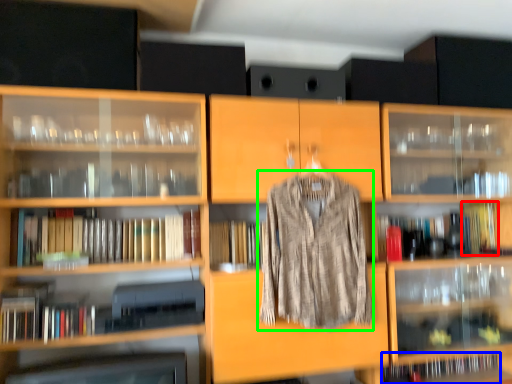
Question: Estimate the real-world distances between objects in this image. Which object is farther from book (highlighted by a red box), book (highlighted by a blue box) or clothing (highlighted by a green box)?

Choices:
 (A) book
 (B) clothing

Answer: (B)